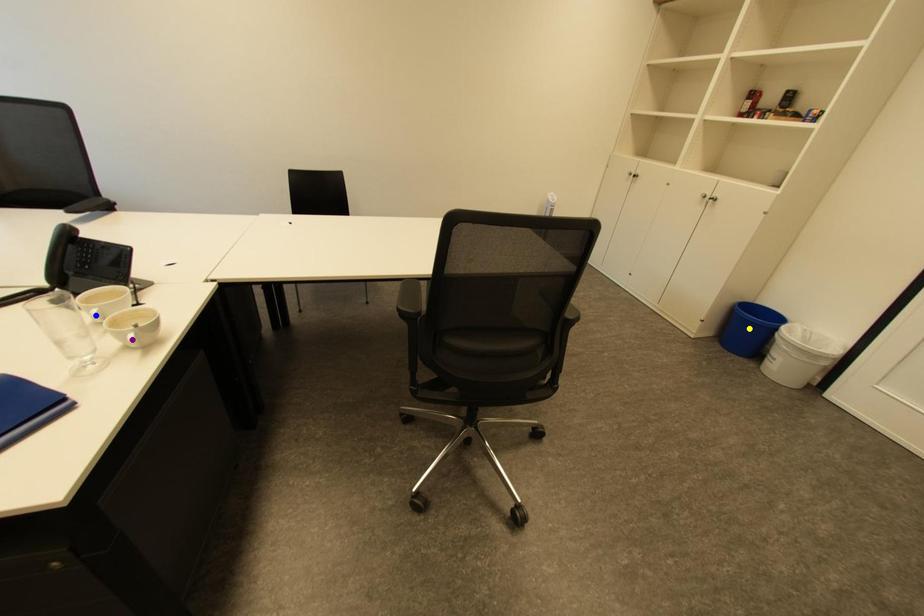
Order these from nearest to farthest:
1. purple point
2. yellow point
3. blue point

yellow point < purple point < blue point